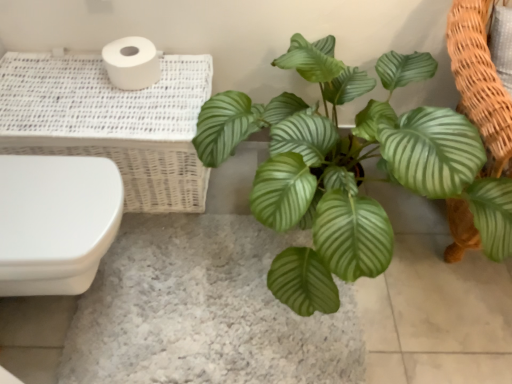
Question: Does white matte toilet paper at upper left appear on the left side of white wicker basket at upper left?

Choices:
 (A) no
 (B) yes

Answer: (A)

Question: Does white matte toilet paper at upper left have a lesser width compared to white wicker basket at upper left?

Choices:
 (A) no
 (B) yes

Answer: (B)

Question: Is white matte toilet paper at upper left at the right side of white wicker basket at upper left?

Choices:
 (A) yes
 (B) no

Answer: (A)

Question: Does white matte toilet paper at upper left have a lesser height compared to white wicker basket at upper left?

Choices:
 (A) yes
 (B) no

Answer: (A)

Question: From a real-world perspective, is white matte toilet paper at upper left under white wicker basket at upper left?

Choices:
 (A) yes
 (B) no

Answer: (B)

Question: Considering the relative sizes of white matte toilet paper at upper left and white wicker basket at upper left in the image provided, is white matte toilet paper at upper left taller than white wicker basket at upper left?

Choices:
 (A) yes
 (B) no

Answer: (B)

Question: Is white matte toilet paper at upper left looking in the opposite direction of green glossy leafy plant at center?

Choices:
 (A) no
 (B) yes

Answer: (A)

Question: Does white matte toilet paper at upper left lie in front of green glossy leafy plant at center?

Choices:
 (A) yes
 (B) no

Answer: (B)

Question: From a real-world perspective, is white matte toilet paper at upper left positioned over green glossy leafy plant at center based on gravity?

Choices:
 (A) no
 (B) yes

Answer: (B)

Question: Considering the relative sizes of white matte toilet paper at upper left and green glossy leafy plant at center in the image provided, is white matte toilet paper at upper left wider than green glossy leafy plant at center?

Choices:
 (A) yes
 (B) no

Answer: (B)

Question: From the image's perspective, would you say white matte toilet paper at upper left is positioned over green glossy leafy plant at center?

Choices:
 (A) yes
 (B) no

Answer: (A)

Question: Does white matte toilet paper at upper left have a greater height compared to green glossy leafy plant at center?

Choices:
 (A) yes
 (B) no

Answer: (B)

Question: Considering the relative sizes of green glossy leafy plant at center and white wicker basket at upper left in the image provided, is green glossy leafy plant at center smaller than white wicker basket at upper left?

Choices:
 (A) no
 (B) yes

Answer: (A)